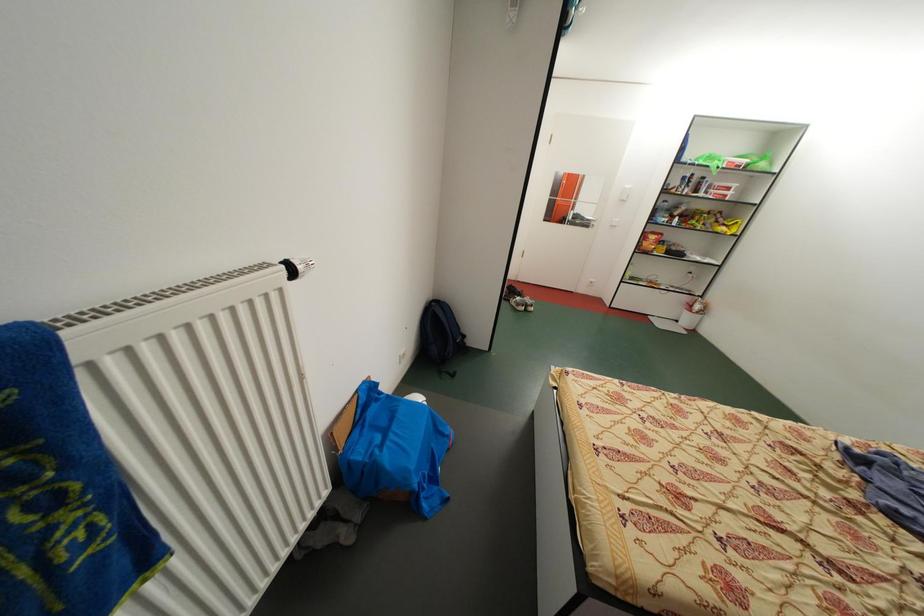
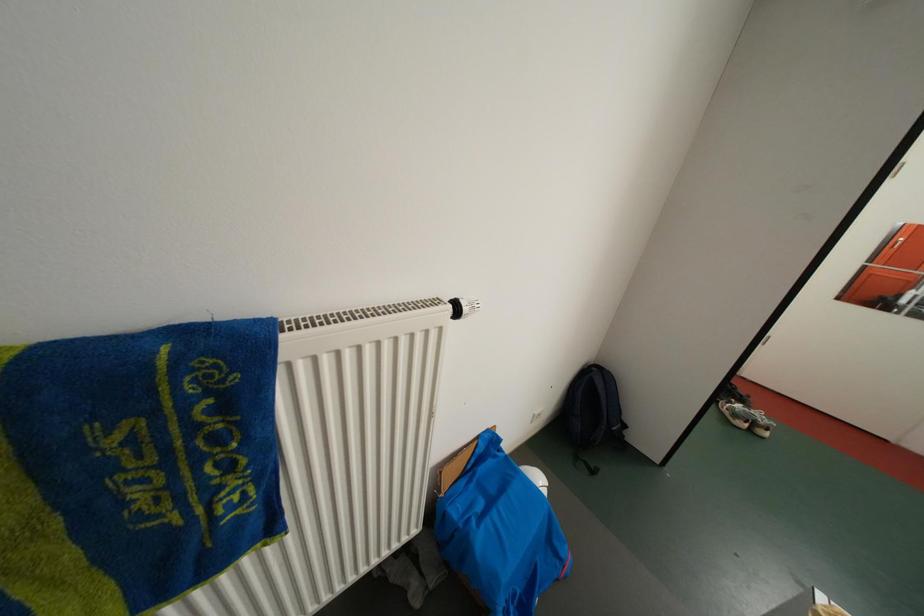
Question: The images are taken continuously from a first-person perspective. In which direction is your viewpoint rotating?

Choices:
 (A) Left
 (B) Right
 (C) Up
 (D) Down

Answer: (A)